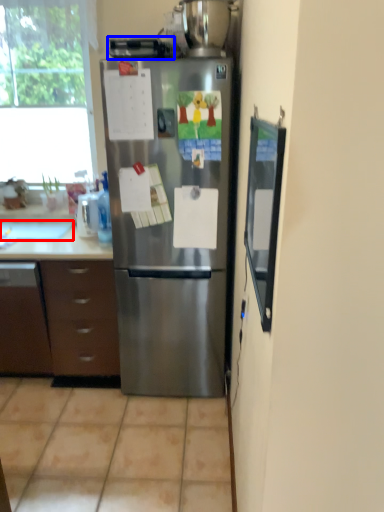
Question: Which of the following is the closest to the observer, sink (highlighted by a red box) or appliance (highlighted by a blue box)?

Choices:
 (A) sink
 (B) appliance

Answer: (B)